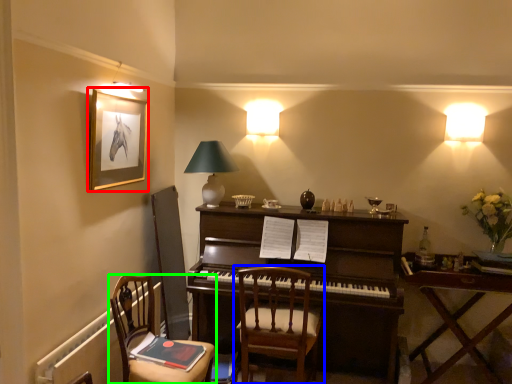
Question: Which object is positioned farthest from picture frame (highlighted by a red box)? Select from chair (highlighted by a blue box) and chair (highlighted by a green box).

Choices:
 (A) chair
 (B) chair

Answer: (A)